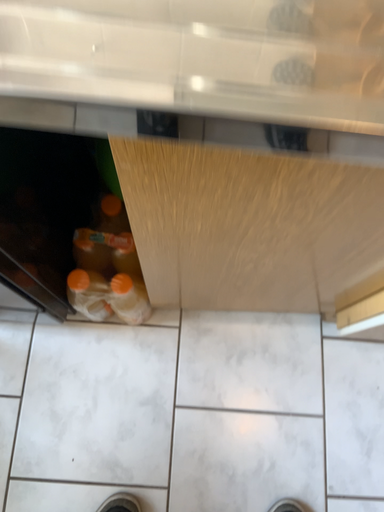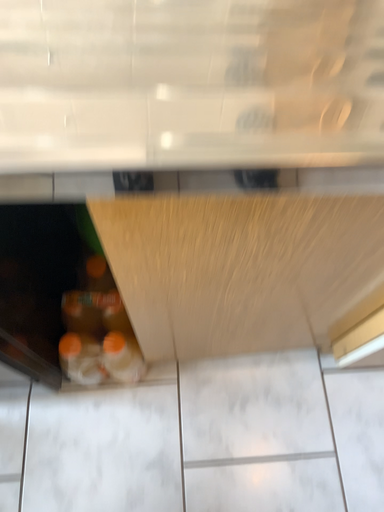
Question: How did the camera likely rotate when shooting the video?

Choices:
 (A) rotated downward
 (B) rotated upward

Answer: (B)